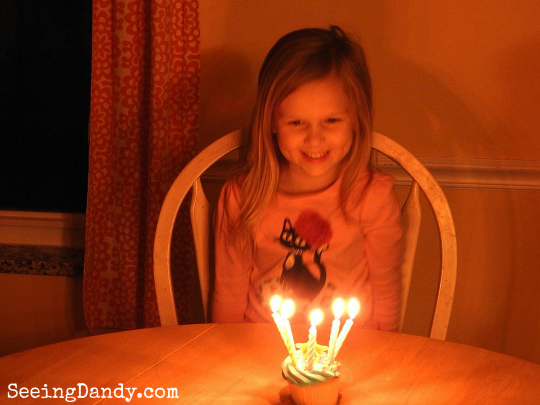
Image resolution: width=540 pixels, height=405 pixels. What are the coordinates of `curtain` in the screenshot? It's located at (136, 84).